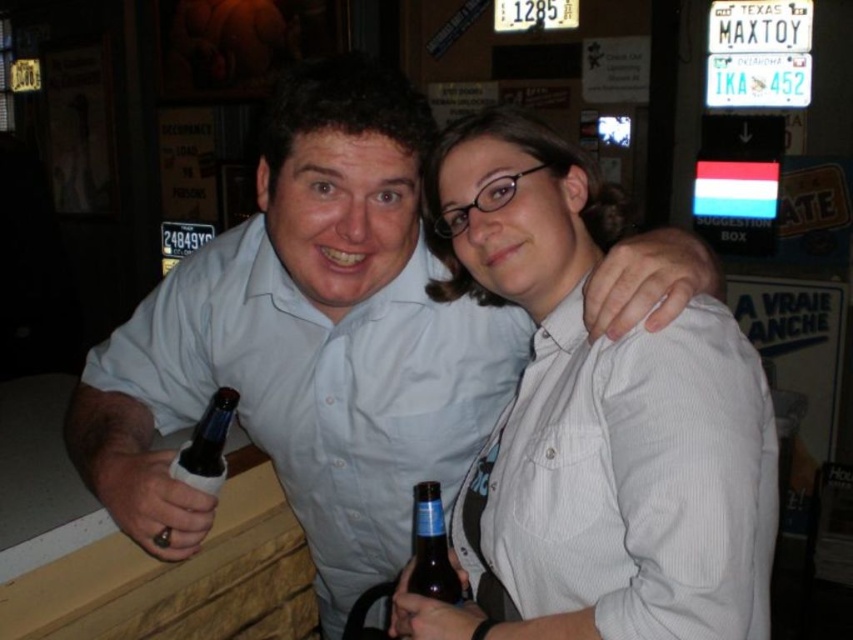
Based on the photo, you are at a bar and want to place a small object between the two points labeled as point (334, 460) and point (216, 432). Considering their positions, which point is closer to the front of the bar?

Point (216, 432) is closer to the front of the bar since it is in front of point (334, 460).

You are a bartender at the bar and need to place a new bottle exactly at the same position as the brown glass bottle at center. What are the coordinates where you should place the new bottle?

The coordinates for the brown glass bottle at center are at point [431,547]. You should place the new bottle at those coordinates.

You are a bartender who needs to choose a bottle for a cocktail that requires a slender bottle to fit in a narrow shelf. Which bottle between the brown glass bottle at center and the dark glass bottle at lower left should you select?

The brown glass bottle at center is thinner than the dark glass bottle at lower left, so you should select the brown glass bottle at center for the narrow shelf.